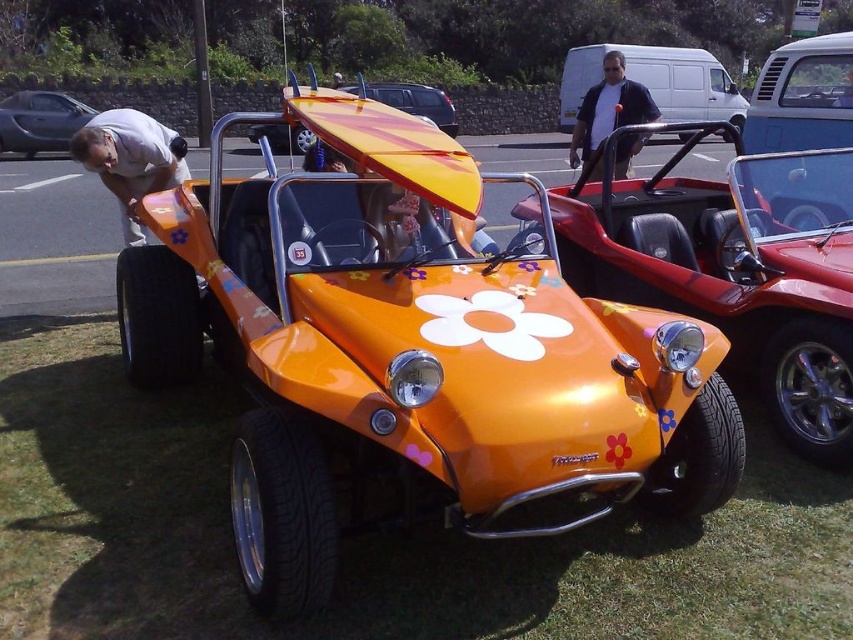
Is point (579, 204) farther from camera compared to point (15, 99)?

No, it is not.

From the picture: Which is above, orange matte surfboard at center or matte black car at left?

Positioned higher is matte black car at left.

Between point (660, 232) and point (49, 116), which one is positioned behind?

The point (49, 116) is more distant.

The height and width of the screenshot is (640, 853). Identify the location of orange matte surfboard at center. (735, 269).

Is orange matte grass at lower left bigger than orange matte surfboard at center?

Yes.

Who is more forward, (x=86, y=573) or (x=581, y=280)?

Positioned in front is point (x=86, y=573).

Locate an element on the screen. The height and width of the screenshot is (640, 853). orange matte grass at lower left is located at coordinates (358, 538).

In the scene shown: Is orange metallic dune buggy at center positioned at the back of matte black car at left?

That is False.

Does orange metallic dune buggy at center appear on the left side of matte black car at left?

In fact, orange metallic dune buggy at center is to the right of matte black car at left.

Image resolution: width=853 pixels, height=640 pixels. What do you see at coordinates (410, 349) in the screenshot?
I see `orange metallic dune buggy at center` at bounding box center [410, 349].

Locate an element on the screen. Image resolution: width=853 pixels, height=640 pixels. orange metallic dune buggy at center is located at coordinates (410, 349).